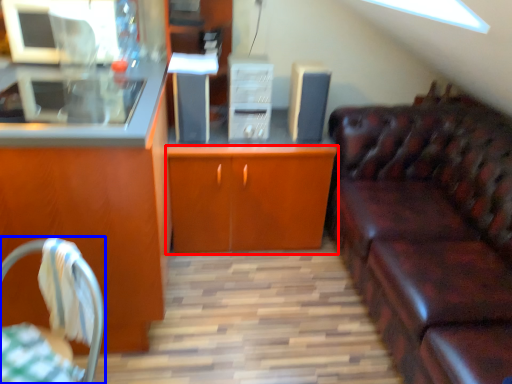
Question: Among these objects, which one is farthest to the camera, cabinetry (highlighted by a red box) or chair (highlighted by a blue box)?

Choices:
 (A) cabinetry
 (B) chair

Answer: (A)